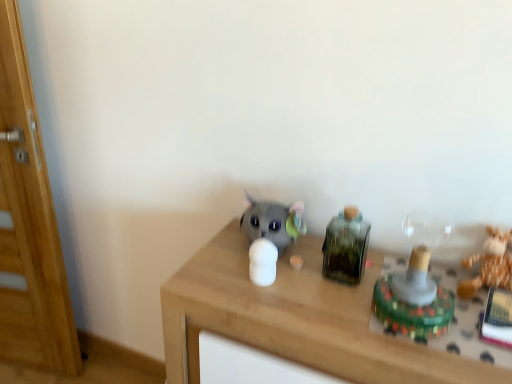
Question: Is wooden door at left closer to the viewer compared to matte gray plush toy at center, positioned as the 1th toy in left-to-right order?

Choices:
 (A) yes
 (B) no

Answer: (B)

Question: Is wooden door at left smaller than matte gray plush toy at center, arranged as the 4th toy when viewed from the right?

Choices:
 (A) yes
 (B) no

Answer: (B)

Question: Is wooden door at left completely or partially outside of matte gray plush toy at center, arranged as the 4th toy when viewed from the right?

Choices:
 (A) yes
 (B) no

Answer: (A)

Question: Considering the relative sizes of wooden door at left and matte gray plush toy at center, positioned as the 1th toy in left-to-right order, in the image provided, is wooden door at left taller than matte gray plush toy at center, positioned as the 1th toy in left-to-right order,?

Choices:
 (A) no
 (B) yes

Answer: (B)

Question: Does wooden door at left appear on the right side of matte gray plush toy at center, arranged as the 4th toy when viewed from the right?

Choices:
 (A) yes
 (B) no

Answer: (B)

Question: Is matte gray plush toy at center, positioned as the 1th toy in left-to-right order, in front of or behind wooden door at left in the image?

Choices:
 (A) front
 (B) behind

Answer: (A)

Question: Looking at the image, does matte gray plush toy at center, arranged as the 4th toy when viewed from the right, seem bigger or smaller compared to wooden door at left?

Choices:
 (A) big
 (B) small

Answer: (B)

Question: In the image, is matte gray plush toy at center, positioned as the 1th toy in left-to-right order, on the left side or the right side of wooden door at left?

Choices:
 (A) right
 (B) left

Answer: (A)

Question: Does point (300, 206) appear closer or farther from the camera than point (26, 185)?

Choices:
 (A) farther
 (B) closer

Answer: (B)

Question: Considering the positions of green glass bottle at center-right, positioned as the second toy in left-to-right order, and brown plush toy at right, which is the fourth toy from left to right, in the image, is green glass bottle at center-right, positioned as the second toy in left-to-right order, bigger or smaller than brown plush toy at right, which is the fourth toy from left to right,?

Choices:
 (A) small
 (B) big

Answer: (A)

Question: From a real-world perspective, is green glass bottle at center-right, positioned as the second toy in left-to-right order, above or below brown plush toy at right, which ranks as the 1th toy in right-to-left order?

Choices:
 (A) below
 (B) above

Answer: (B)

Question: Considering the positions of green glass bottle at center-right, arranged as the third toy when viewed from the right, and brown plush toy at right, which ranks as the 1th toy in right-to-left order, in the image, is green glass bottle at center-right, arranged as the third toy when viewed from the right, taller or shorter than brown plush toy at right, which ranks as the 1th toy in right-to-left order,?

Choices:
 (A) tall
 (B) short

Answer: (A)

Question: Is green glass bottle at center-right, arranged as the third toy when viewed from the right, spatially inside brown plush toy at right, which is the fourth toy from left to right, or outside of it?

Choices:
 (A) inside
 (B) outside

Answer: (B)

Question: Considering the positions of brown plush toy at right, which is the fourth toy from left to right, and translucent plastic toy at right, the second toy positioned from the right, in the image, is brown plush toy at right, which is the fourth toy from left to right, bigger or smaller than translucent plastic toy at right, the second toy positioned from the right,?

Choices:
 (A) big
 (B) small

Answer: (B)

Question: From a real-world perspective, is brown plush toy at right, which ranks as the 1th toy in right-to-left order, positioned above or below translucent plastic toy at right, the second toy positioned from the right?

Choices:
 (A) above
 (B) below

Answer: (B)